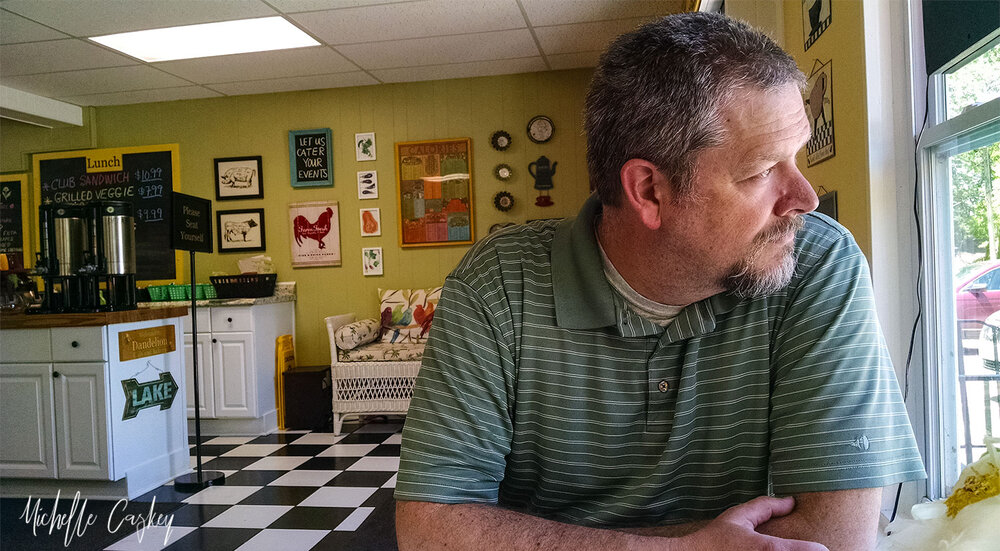
Find the location of a particular element. The height and width of the screenshot is (551, 1000). coffee urns is located at coordinates (114, 243), (71, 235).